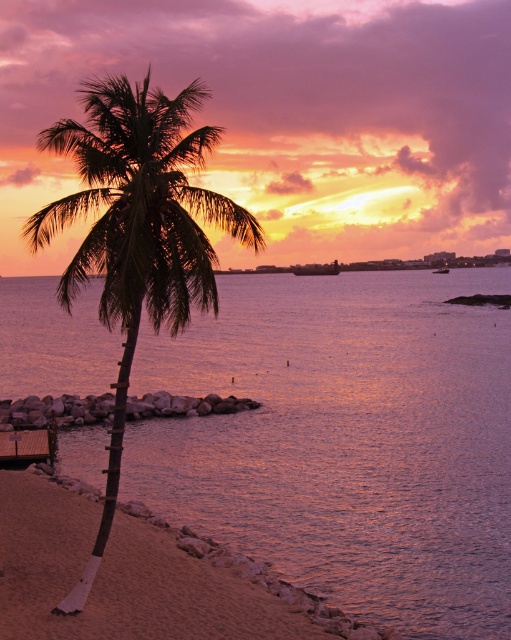
Question: Which point appears closest to the camera in this image?

Choices:
 (A) click(x=435, y=608)
 (B) click(x=42, y=548)
 (C) click(x=181, y=147)

Answer: (C)

Question: Does purple reflective water at center have a lesser width compared to sandy beach at lower left?

Choices:
 (A) no
 (B) yes

Answer: (A)

Question: Which of the following is the farthest from the observer?

Choices:
 (A) (63, 556)
 (B) (192, 269)
 (C) (492, 598)

Answer: (C)

Question: Does purple reflective water at center appear under green leafy palm tree at left?

Choices:
 (A) no
 (B) yes

Answer: (B)

Question: Is purple reflective water at center bigger than green leafy palm tree at left?

Choices:
 (A) yes
 (B) no

Answer: (B)

Question: Among these objects, which one is farthest from the camera?

Choices:
 (A) sandy beach at lower left
 (B) green leafy palm tree at left
 (C) purple reflective water at center

Answer: (C)